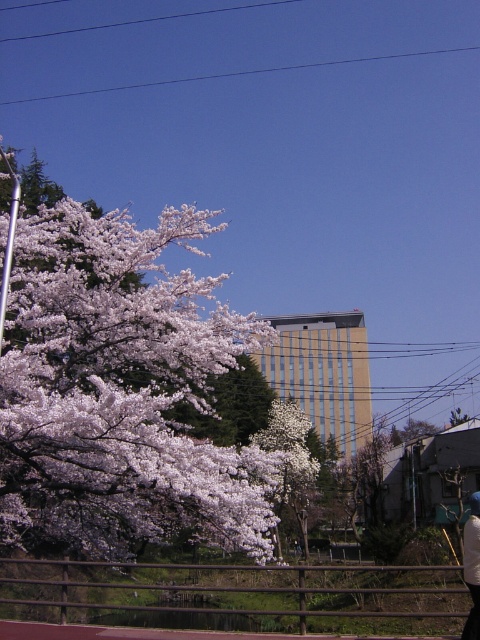
Question: Which point is farther to the camera?

Choices:
 (A) (303, 432)
 (B) (183, 481)

Answer: (A)

Question: Is white matte flower at upper left smaller than white cotton jacket at lower right?

Choices:
 (A) no
 (B) yes

Answer: (A)

Question: Is white matte flower at upper left thinner than white blossoming tree at center?

Choices:
 (A) yes
 (B) no

Answer: (B)

Question: Which point appears farthest from the camera in this image?

Choices:
 (A) (291, 433)
 (B) (61, 428)
 (C) (477, 492)

Answer: (A)

Question: Can you confirm if white matte flower at upper left is smaller than white cotton jacket at lower right?

Choices:
 (A) no
 (B) yes

Answer: (A)

Question: Which object appears closest to the camera in this image?

Choices:
 (A) white cotton jacket at lower right
 (B) white matte flower at upper left

Answer: (A)